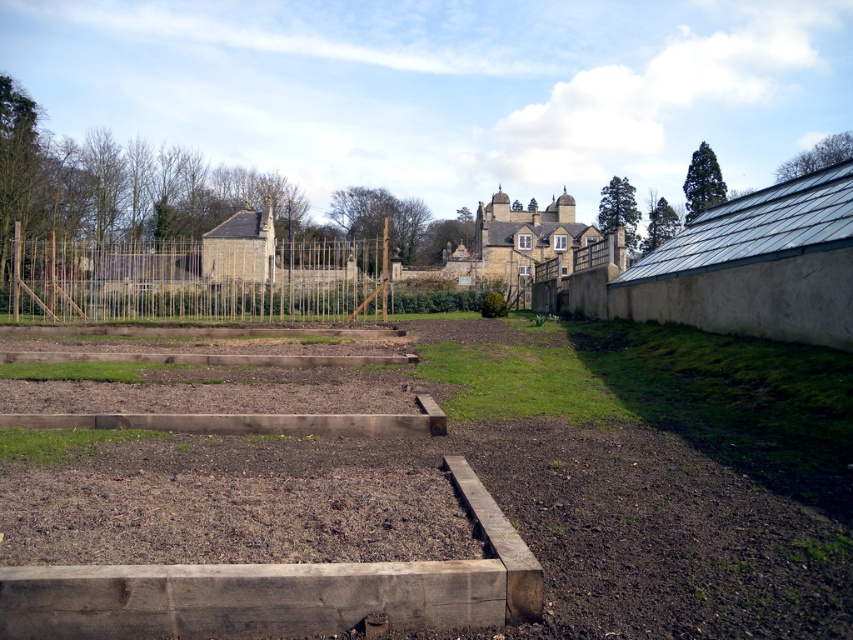
Can you confirm if brown wooden raised beds at center is positioned to the right of wooden fence at center?

Correct, you'll find brown wooden raised beds at center to the right of wooden fence at center.

Does point (396, 444) come in front of point (251, 244)?

Yes.

Locate an element on the screen. The height and width of the screenshot is (640, 853). brown wooden raised beds at center is located at coordinates click(x=498, y=472).

The width and height of the screenshot is (853, 640). Find the location of `brown wooden raised beds at center`. brown wooden raised beds at center is located at coordinates (498, 472).